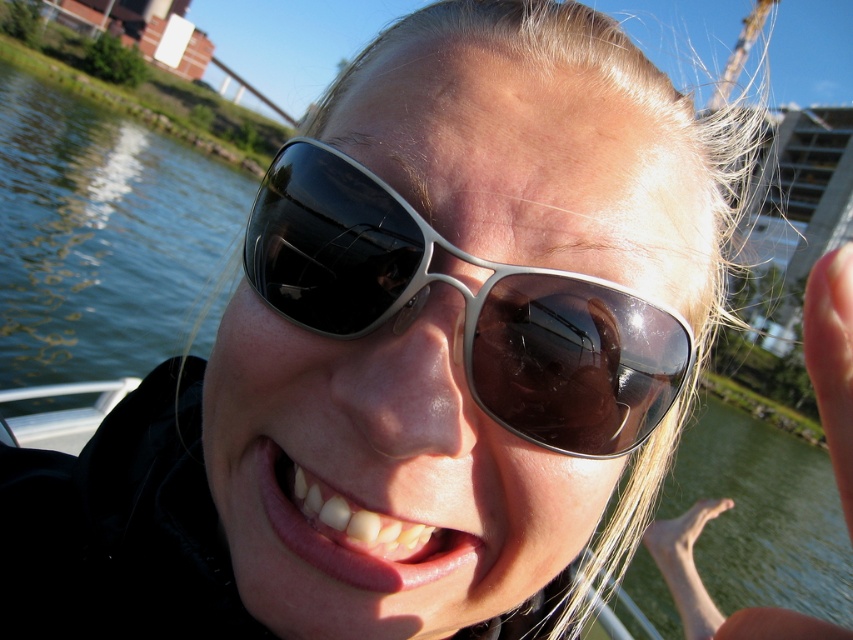
You are a photographer planning to capture the reflection of the surroundings in the metallic silver aviator sunglasses at center and the clear water at lower left. Which object would allow you to see a larger portion of the environment reflected?

The clear water at lower left allows you to see a larger portion of the environment reflected because it occupies more space than the metallic silver aviator sunglasses at center.

Based on the coordinates provided, what object is located at point (103, 237) in the image?

The point (103, 237) indicates clear water at lower left.